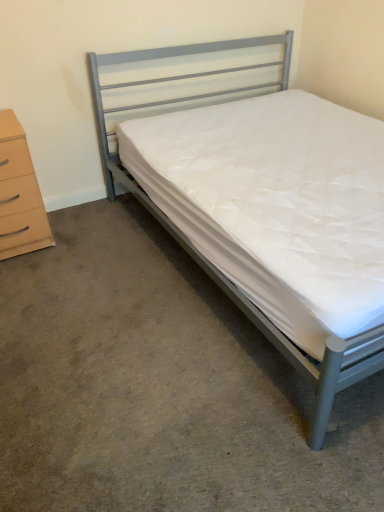
Locate an element on the screen. The width and height of the screenshot is (384, 512). beige wood chest of drawers at left is located at coordinates (19, 194).

Identify the location of beige wood chest of drawers at left. This screenshot has width=384, height=512. click(19, 194).

Locate an element on the screen. The width and height of the screenshot is (384, 512). the chest of drawers above the white quilted mattress at center (from the image's perspective) is located at coordinates click(x=19, y=194).

From the image's perspective, would you say beige wood chest of drawers at left is positioned over white quilted mattress at center?

Yes, from the image's perspective, beige wood chest of drawers at left is above white quilted mattress at center.

Consider the image. Is beige wood chest of drawers at left in contact with white quilted mattress at center?

They are not placed beside each other.

From a real-world perspective, which is physically above, beige wood chest of drawers at left or metallic gray bed at center?

From a 3D spatial view, metallic gray bed at center is above.

Would you say beige wood chest of drawers at left is to the left or to the right of metallic gray bed at center in the picture?

→ Clearly, beige wood chest of drawers at left is on the left of metallic gray bed at center in the image.

Can you confirm if beige wood chest of drawers at left is shorter than metallic gray bed at center?

Indeed, beige wood chest of drawers at left has a lesser height compared to metallic gray bed at center.

Is white quilted mattress at center turned away from beige wood chest of drawers at left?

No, beige wood chest of drawers at left is not at the back of white quilted mattress at center.

Does white quilted mattress at center appear on the left side of beige wood chest of drawers at left?

Incorrect, white quilted mattress at center is not on the left side of beige wood chest of drawers at left.

Can you confirm if white quilted mattress at center is thinner than beige wood chest of drawers at left?

In fact, white quilted mattress at center might be wider than beige wood chest of drawers at left.

Considering the relative positions of white quilted mattress at center and beige wood chest of drawers at left in the image provided, is white quilted mattress at center in front of beige wood chest of drawers at left?

Yes, white quilted mattress at center is closer to the camera.

Is white quilted mattress at center looking in the opposite direction of metallic gray bed at center?

That's not correct — white quilted mattress at center is not looking away from metallic gray bed at center.

Can you confirm if white quilted mattress at center is smaller than metallic gray bed at center?

Yes.

Which point is more distant from viewer, [173,508] or [196,97]?

The point [196,97] is farther.

Is the depth of white quilted mattress at center greater than that of metallic gray bed at center?

Yes, it is behind metallic gray bed at center.

Consider the image. Considering the positions of objects metallic gray bed at center and white quilted mattress at center in the image provided, who is more to the right, metallic gray bed at center or white quilted mattress at center?

Positioned to the right is metallic gray bed at center.

Does metallic gray bed at center turn towards white quilted mattress at center?

No, metallic gray bed at center is not turned towards white quilted mattress at center.

Between metallic gray bed at center and white quilted mattress at center, which one has smaller size?

white quilted mattress at center.

This screenshot has width=384, height=512. I want to click on bed above the white quilted mattress at center (from the image's perspective), so click(x=203, y=256).

How far apart are metallic gray bed at center and beige wood chest of drawers at left?

metallic gray bed at center and beige wood chest of drawers at left are 29.06 inches apart.

Is there a large distance between metallic gray bed at center and beige wood chest of drawers at left?

They are positioned close to each other.

Is beige wood chest of drawers at left a part of metallic gray bed at center?

No, metallic gray bed at center does not contain beige wood chest of drawers at left.

Which object is further away from the camera taking this photo, metallic gray bed at center or beige wood chest of drawers at left?

beige wood chest of drawers at left is further from the camera.

The width and height of the screenshot is (384, 512). Identify the location of concrete below the beige wood chest of drawers at left (from a real-world perspective). (159, 386).

At what (x,y) coordinates should I click in order to perform the action: click on bed in front of the beige wood chest of drawers at left. Please return your answer as a coordinate pair (x, y). Looking at the image, I should click on (203, 256).

Based on their spatial positions, is metallic gray bed at center or white quilted mattress at center closer to beige wood chest of drawers at left?

Among the two, metallic gray bed at center is located nearer to beige wood chest of drawers at left.

Which object lies nearer to the anchor point metallic gray bed at center, white quilted mattress at center or beige wood chest of drawers at left?

Based on the image, beige wood chest of drawers at left appears to be nearer to metallic gray bed at center.

Considering their positions, is metallic gray bed at center positioned closer to white quilted mattress at center than beige wood chest of drawers at left?

Among the two, beige wood chest of drawers at left is located nearer to white quilted mattress at center.

From the picture: Considering their positions, is beige wood chest of drawers at left positioned further to white quilted mattress at center than metallic gray bed at center?

metallic gray bed at center lies further to white quilted mattress at center than the other object.

Considering their positions, is beige wood chest of drawers at left positioned closer to metallic gray bed at center than white quilted mattress at center?

The object closer to metallic gray bed at center is beige wood chest of drawers at left.

Which object lies nearer to the anchor point beige wood chest of drawers at left, white quilted mattress at center or metallic gray bed at center?

metallic gray bed at center.

This screenshot has width=384, height=512. Identify the location of concrete situated between beige wood chest of drawers at left and metallic gray bed at center from left to right. (159, 386).